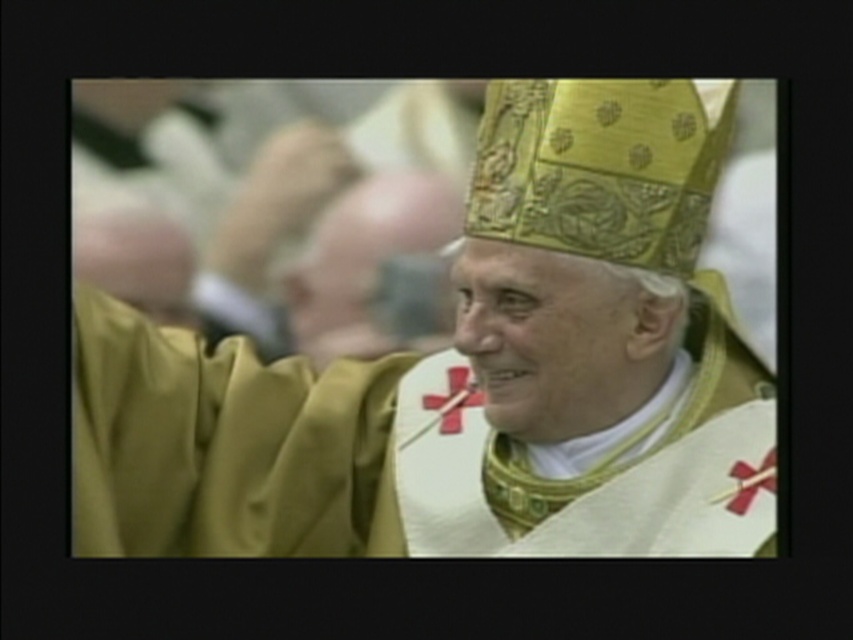
You are a photographer taking a picture of the religious figure. You notice two points marked in the image at coordinates point (601,381) and point (447,410). Which point is closer to your camera lens?

Point (601,381) is closer to the camera than point (447,410).

Consider the image. You are an assistant helping to arrange a religious ceremony. The gold textured mitre at center needs to be placed on a shelf. The shelf has a coordinate system where the center is at point 0.5,0.5. Where should you place the mitre to ensure it is centered on the shelf?

The gold textured mitre at center is already located at point (471,376), which is very close to the center of the shelf. To ensure it is perfectly centered, adjust it slightly towards the exact center coordinates of (426,320).

You are a photographer capturing the ceremonial attire of a religious figure. You notice the gold textured mitre at center and the gold textured robe at center. Which object is located to the right of the other?

The gold textured mitre at center is positioned on the right side of gold textured robe at center.